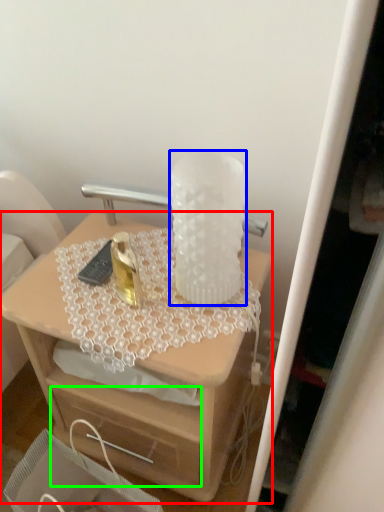
Question: Based on their relative distances, which object is farther from desk (highlighted by a red box)? Choose from vase (highlighted by a blue box) and drawer (highlighted by a green box).

Choices:
 (A) vase
 (B) drawer

Answer: (A)